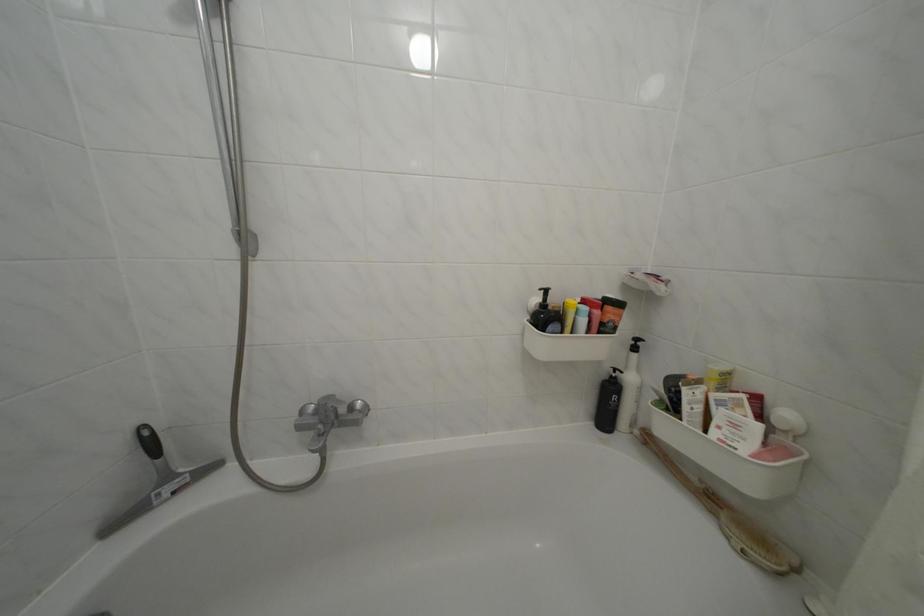
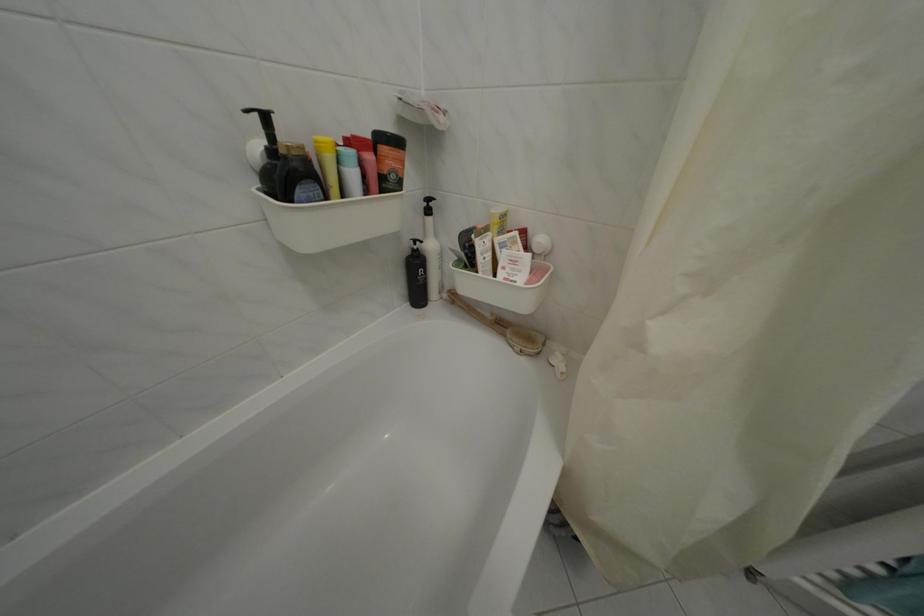
Locate, in the second image, the point that corresponds to the point at 546,315 in the first image.

(274, 166)